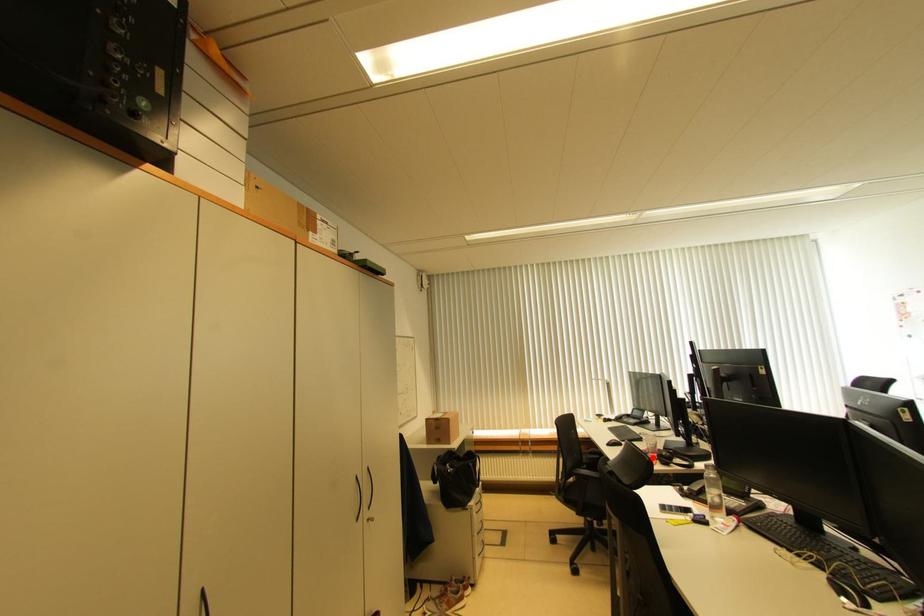
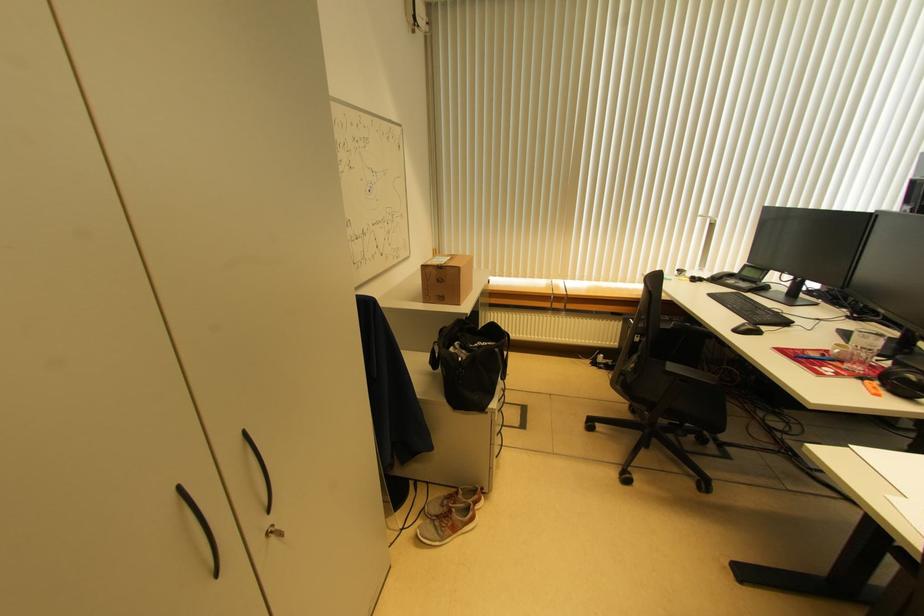
Find the pixel in the second image that matches the highlighted location in the first image.

(849, 368)